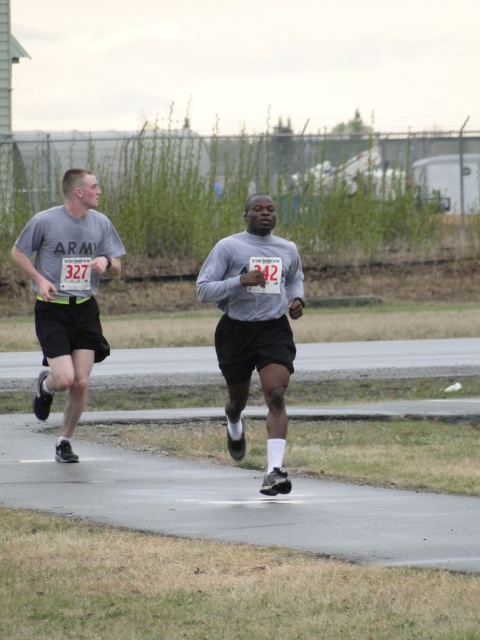
Does gray matte shirt at center appear on the right side of matte gray shirt at left?

Yes, gray matte shirt at center is to the right of matte gray shirt at left.

Is gray matte shirt at center smaller than matte gray shirt at left?

Indeed, gray matte shirt at center has a smaller size compared to matte gray shirt at left.

Identify the location of gray matte shirt at center. (254, 326).

Which is in front, point (6, 420) or point (75, 225)?

Point (75, 225)

Measure the distance between gray asphalt pavement at center and camera.

gray asphalt pavement at center is 8.57 meters from camera.

Who is more distant from viewer, (432, 552) or (70, 348)?

Positioned behind is point (70, 348).

The image size is (480, 640). Identify the location of gray asphalt pavement at center. (236, 502).

In the scene shown: Is gray asphalt pavement at center thinner than gray matte shirt at center?

No, gray asphalt pavement at center is not thinner than gray matte shirt at center.

How much distance is there between gray asphalt pavement at center and gray matte shirt at center?

gray asphalt pavement at center is 39.19 inches from gray matte shirt at center.

Find the location of a particular element. This screenshot has height=640, width=480. gray asphalt pavement at center is located at coordinates (236, 502).

Identify the location of gray asphalt pavement at center. (236, 502).